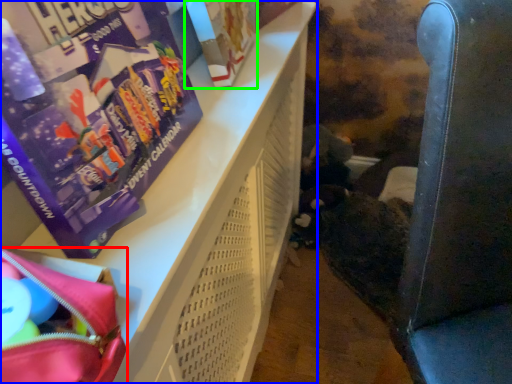
Question: Estimate the real-world distances between objects in this image. Which object is closer to bag (highlighted by a red box), furniture (highlighted by a blue box) or paperback book (highlighted by a green box)?

Choices:
 (A) furniture
 (B) paperback book

Answer: (A)